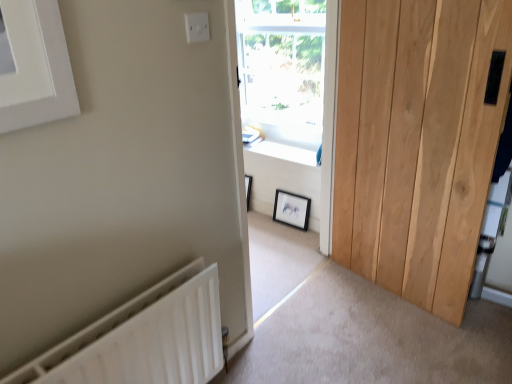
Find the location of `vacant space to the left of natural wood door at right`. vacant space to the left of natural wood door at right is located at coordinates (327, 313).